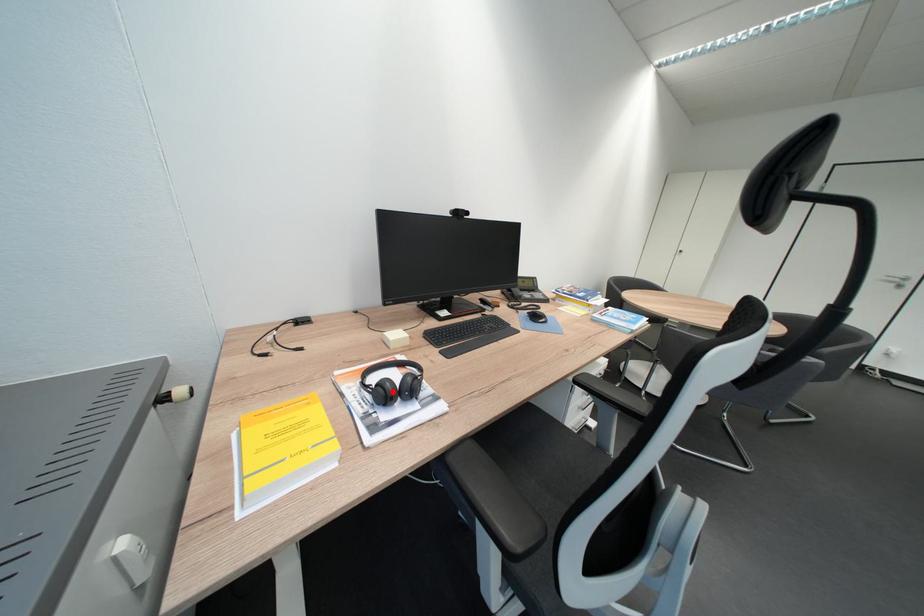
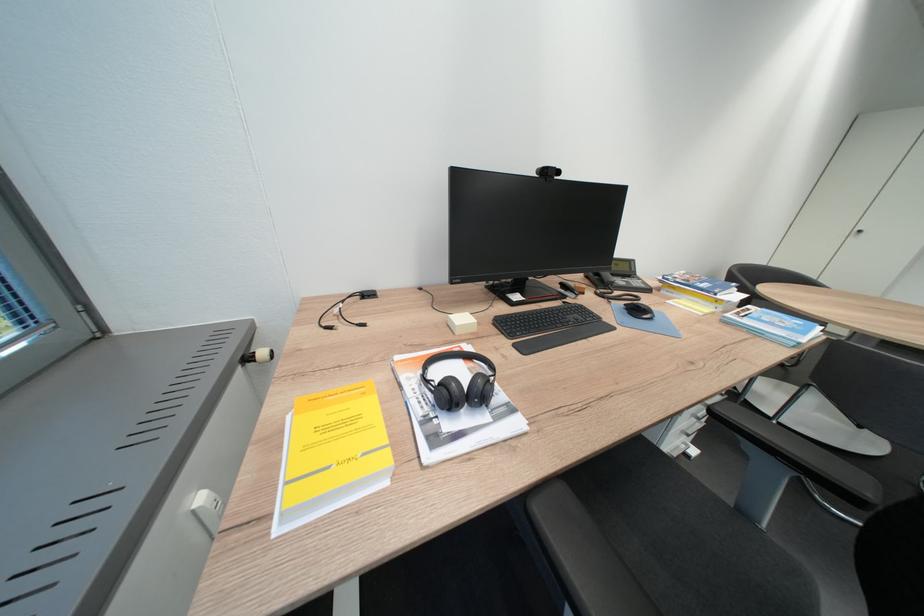
Where in the second image is the point corresponding to the highlighted location from the first image?

(456, 392)